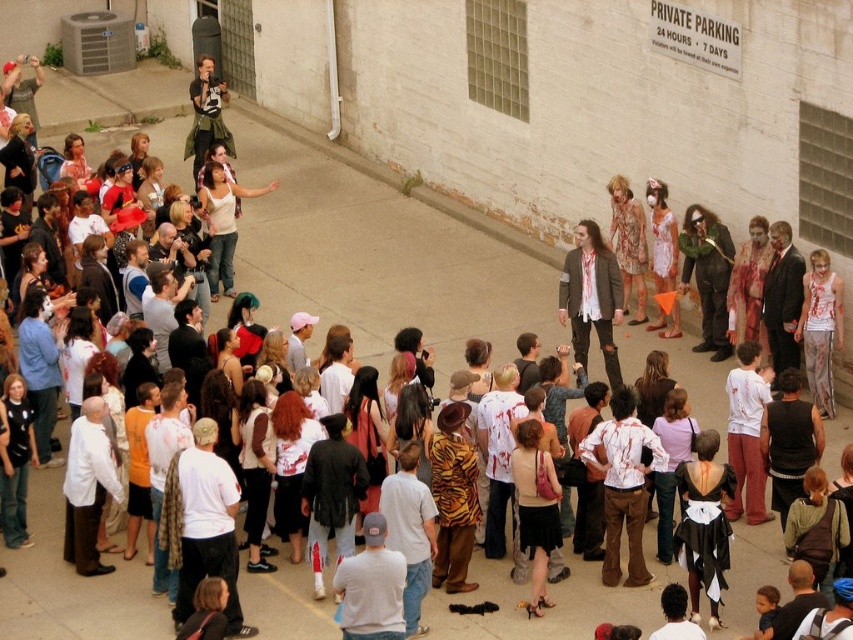
Based on the photo, does blood-stained cotton shirt at center have a greater width compared to matte white dress at center?

Indeed, blood-stained cotton shirt at center has a greater width compared to matte white dress at center.

Which is above, blood-stained cotton shirt at center or matte white dress at center?

matte white dress at center is higher up.

Does point (618, 396) lie behind point (651, 330)?

That is False.

You are a GUI agent. You are given a task and a screenshot of the screen. Output one action in this format:
    pyautogui.click(x=<x>, y=<y>)
    Task: Click on the blood-stained cotton shirt at center
    The height and width of the screenshot is (640, 853).
    Given the screenshot: What is the action you would take?
    pyautogui.click(x=622, y=483)

Is green fuzzy coat at center below floral dress at center?

Yes.

At what (x,y) coordinates should I click in order to perform the action: click on green fuzzy coat at center. Please return your answer as a coordinate pair (x, y). Looking at the image, I should click on (706, 275).

Does point (691, 236) lie behind point (637, 260)?

No.

At what (x,y) coordinates should I click in order to perform the action: click on green fuzzy coat at center. Please return your answer as a coordinate pair (x, y). The height and width of the screenshot is (640, 853). Looking at the image, I should click on (706, 275).

Based on the photo, does ripped denim jeans at center have a lesser width compared to white tank top at center?

Yes.

Which is more to the right, ripped denim jeans at center or white tank top at center?

Positioned to the right is ripped denim jeans at center.

You are a GUI agent. You are given a task and a screenshot of the screen. Output one action in this format:
    pyautogui.click(x=<x>, y=<y>)
    Task: Click on the ripped denim jeans at center
    The width and height of the screenshot is (853, 640).
    Given the screenshot: What is the action you would take?
    pyautogui.click(x=590, y=298)